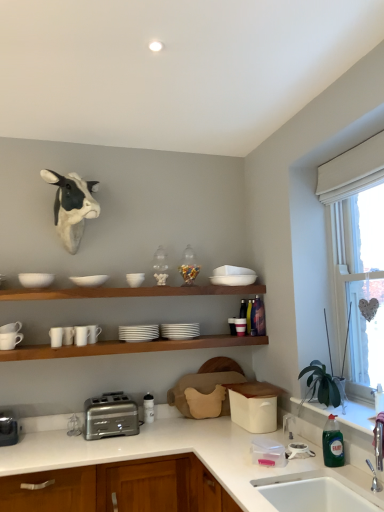
Question: Does green glass bottle at lower right appear on the right side of white ceramic cups at center?

Choices:
 (A) yes
 (B) no

Answer: (A)

Question: From the image's perspective, would you say green glass bottle at lower right is positioned over white ceramic cups at center?

Choices:
 (A) yes
 (B) no

Answer: (B)

Question: Is green glass bottle at lower right oriented away from white ceramic cups at center?

Choices:
 (A) yes
 (B) no

Answer: (B)

Question: From a real-world perspective, is green glass bottle at lower right under white ceramic cups at center?

Choices:
 (A) yes
 (B) no

Answer: (A)

Question: From a real-world perspective, is green glass bottle at lower right on top of white ceramic cups at center?

Choices:
 (A) no
 (B) yes

Answer: (A)

Question: In terms of height, does white matte bowl at upper left, the second mixing bowl from the right, look taller or shorter compared to wooden shelf at upper center?

Choices:
 (A) short
 (B) tall

Answer: (B)

Question: Looking at the image, does white matte bowl at upper left, the second mixing bowl from the right, seem bigger or smaller compared to wooden shelf at upper center?

Choices:
 (A) small
 (B) big

Answer: (A)

Question: Do you think white matte bowl at upper left, positioned as the 1th mixing bowl in left-to-right order, is within wooden shelf at upper center, or outside of it?

Choices:
 (A) inside
 (B) outside

Answer: (B)

Question: From a real-world perspective, is white matte bowl at upper left, the second mixing bowl from the right, above or below wooden shelf at upper center?

Choices:
 (A) below
 (B) above

Answer: (B)

Question: Based on their positions, is white glossy mug at left, placed as the 5th tableware when sorted from right to left, located to the left or right of white matte bowl at upper left, positioned as the 1th mixing bowl in left-to-right order?

Choices:
 (A) right
 (B) left

Answer: (A)

Question: Is point (81, 340) closer or farther from the camera than point (48, 275)?

Choices:
 (A) closer
 (B) farther

Answer: (A)

Question: Considering their positions, is white glossy mug at left, which is the fourth tableware from left to right, located in front of or behind white matte bowl at upper left, the second mixing bowl from the right?

Choices:
 (A) front
 (B) behind

Answer: (B)

Question: From a real-world perspective, is white glossy mug at left, which is the fourth tableware from left to right, physically located above or below white matte bowl at upper left, positioned as the 1th mixing bowl in left-to-right order?

Choices:
 (A) above
 (B) below

Answer: (B)

Question: Considering the positions of white matte mug at upper left, the 2th tableware positioned from the left, and white glossy countertop at lower center in the image, is white matte mug at upper left, the 2th tableware positioned from the left, bigger or smaller than white glossy countertop at lower center?

Choices:
 (A) small
 (B) big

Answer: (A)

Question: Would you say white matte mug at upper left, the 2th tableware positioned from the left, is to the left or to the right of white glossy countertop at lower center in the picture?

Choices:
 (A) left
 (B) right

Answer: (A)